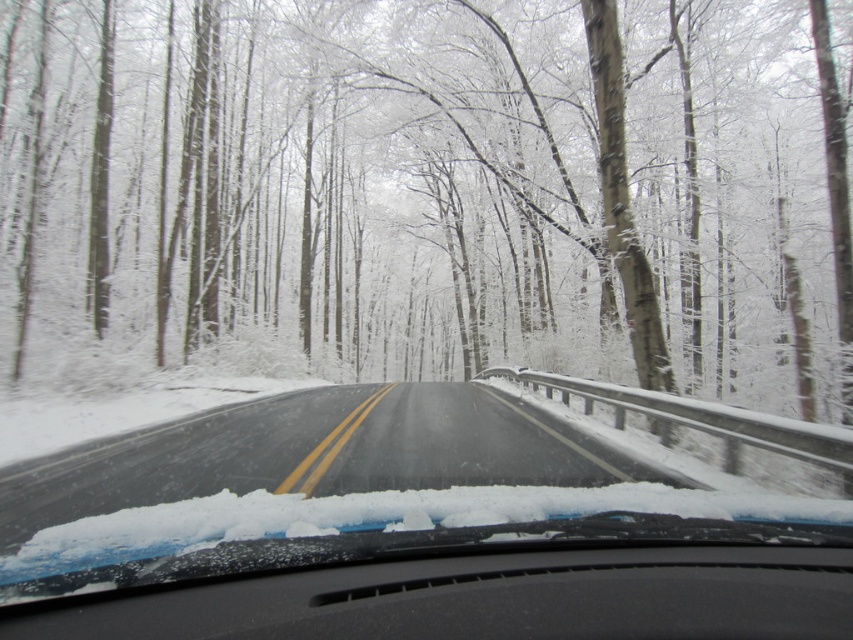
Who is taller, snow-covered trees at center or black matte dashboard at center?

Standing taller between the two is snow-covered trees at center.

Which of these two, snow-covered trees at center or black matte dashboard at center, stands shorter?

Standing shorter between the two is black matte dashboard at center.

Between point (323, 99) and point (91, 620), which one is positioned behind?

The point (323, 99) is behind.

The width and height of the screenshot is (853, 640). What are the coordinates of `snow-covered trees at center` in the screenshot? It's located at (430, 189).

Who is higher up, black rubber windshield wiper at center or black matte dashboard at center?

black matte dashboard at center

Does black rubber windshield wiper at center have a lesser height compared to black matte dashboard at center?

In fact, black rubber windshield wiper at center may be taller than black matte dashboard at center.

Locate an element on the screen. black rubber windshield wiper at center is located at coordinates (410, 525).

Between snow-covered trees at center and black rubber windshield wiper at center, which one is positioned higher?

snow-covered trees at center

Who is more distant from viewer, (473, 29) or (552, 630)?

The point (473, 29) is more distant.

The height and width of the screenshot is (640, 853). I want to click on snow-covered trees at center, so click(430, 189).